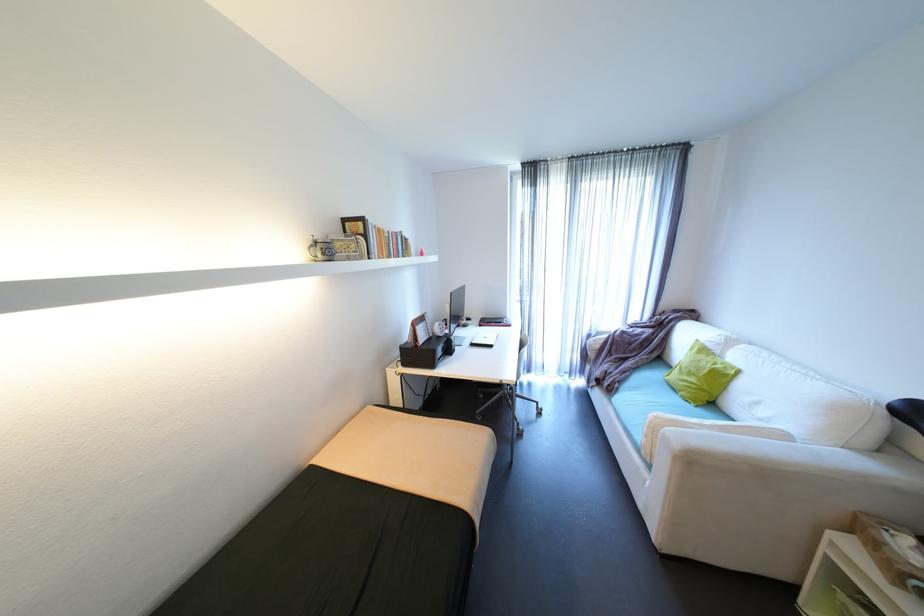
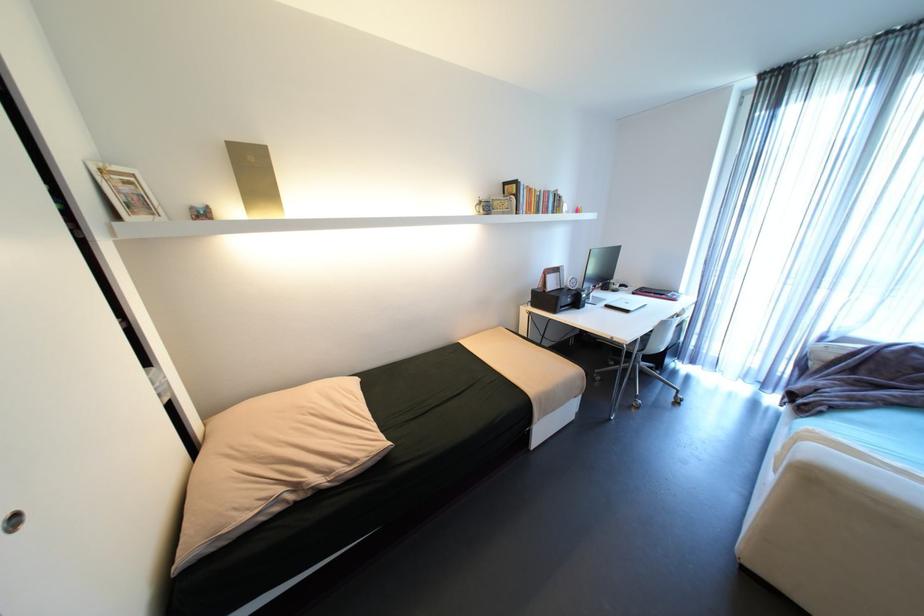
Question: The first image is from the beginning of the video and the second image is from the end. How did the camera likely rotate when shooting the video?

Choices:
 (A) Left
 (B) Right
 (C) Up
 (D) Down

Answer: (A)